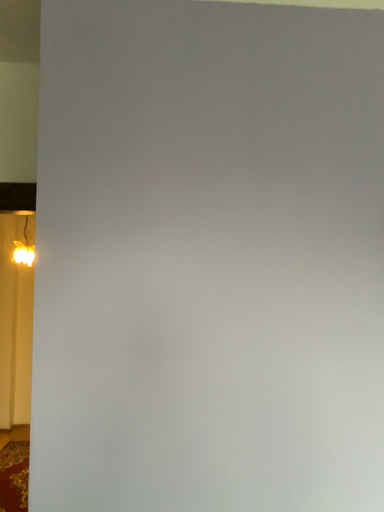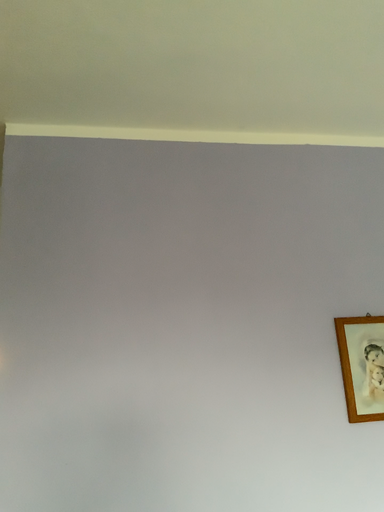
Question: How did the camera likely rotate when shooting the video?

Choices:
 (A) rotated upward
 (B) rotated downward

Answer: (A)